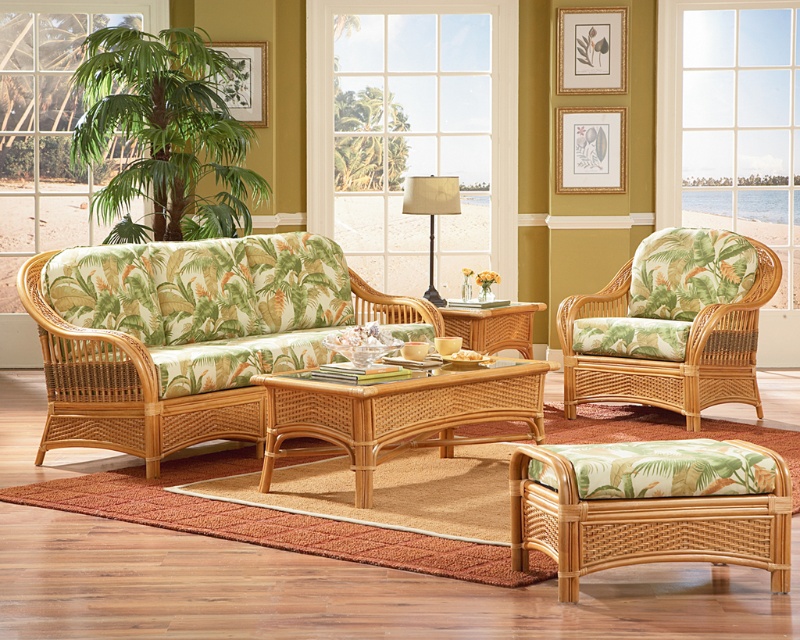
You are a delivery person trying to place a 3.5 meter long sofa in the living room. The sofa must be placed between the transparent glass window at upper left and the metallic gold lampshade at center. Can the sofa fit in that space?

The distance between the transparent glass window at upper left and the metallic gold lampshade at center is 6.67 meters. Since the sofa is 3.5 meters long, it can fit in the space as there is enough room between them.

You are planning to hang a large painting that requires a space wider than the clear glass window at center. Based on the scene, is there enough space on the wall next to the metallic gold lampshade at center to accommodate the painting?

The clear glass window at center is larger than the metallic gold lampshade at center. Since the painting requires a space wider than the window, and the lampshade is smaller, the wall next to the metallic gold lampshade at center may not have enough space to fit the painting.